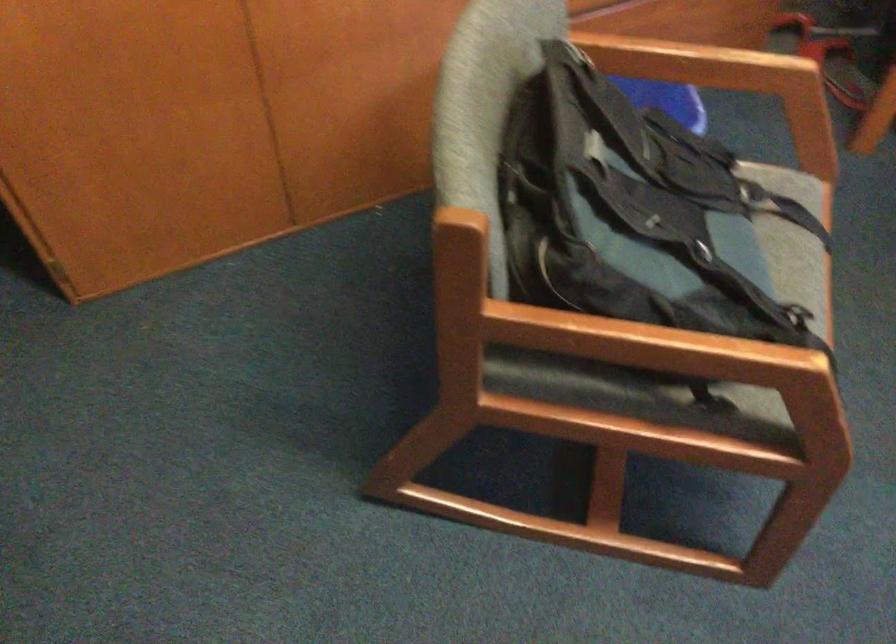
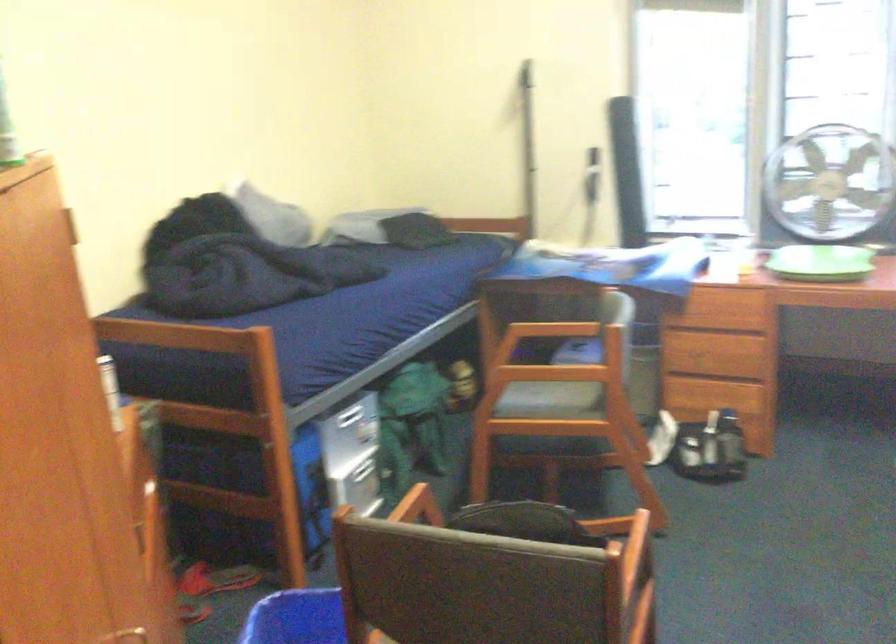
Find the pixel in the second image that matches [684,120] in the first image.

(297, 618)